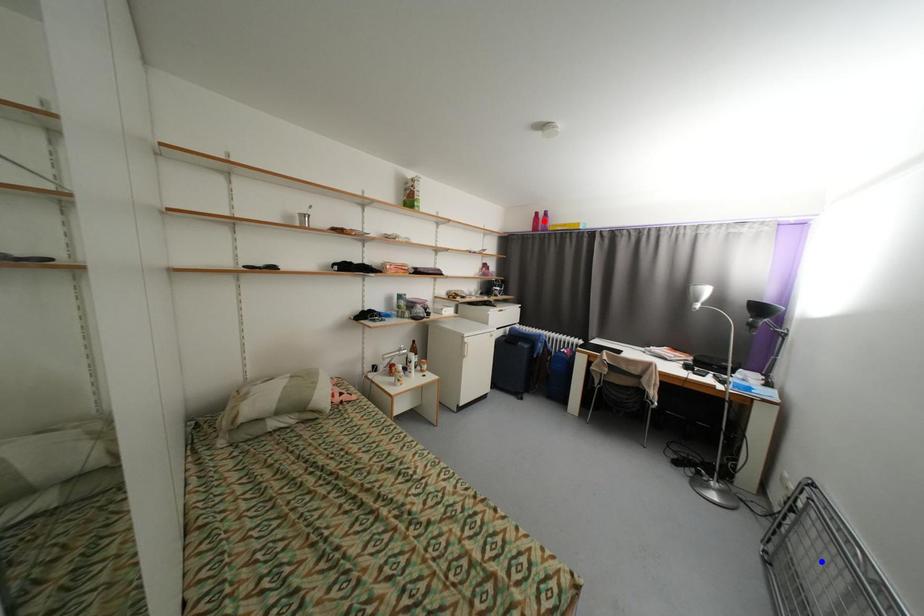
Question: Which of the two points in the image is closer to the camera?

Choices:
 (A) Blue point is closer.
 (B) Red point is closer.

Answer: (A)